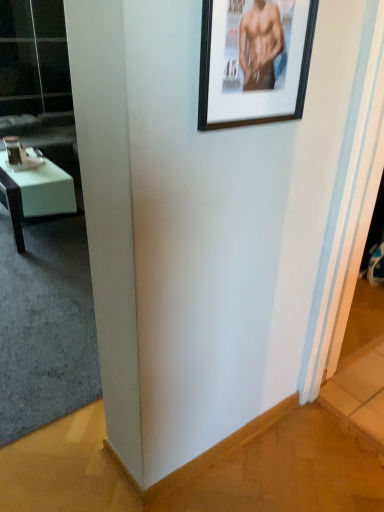
Where is `transparent glass door at upper left`? Image resolution: width=384 pixels, height=512 pixels. transparent glass door at upper left is located at coordinates (33, 58).

I want to click on white leather couch at left, so click(x=39, y=129).

What are the coordinates of `black matte picture frame at upper right` in the screenshot? It's located at (254, 61).

At what (x,y) coordinates should I click in order to perform the action: click on white glossy desk at left. Please return your answer as a coordinate pair (x, y). The image size is (384, 512). Looking at the image, I should click on (35, 194).

Where is `transparent glass door at upper left`? This screenshot has width=384, height=512. transparent glass door at upper left is located at coordinates (33, 58).

Which of these two, black matte picture frame at upper right or white leather couch at left, stands shorter?

With less height is black matte picture frame at upper right.

Is point (245, 96) less distant than point (2, 132)?

Yes, it is.

Which of these two, black matte picture frame at upper right or white leather couch at left, is bigger?

white leather couch at left is bigger.

From the image's perspective, is white leather couch at left on top of black matte picture frame at upper right?

Indeed, from the image's perspective, white leather couch at left is shown above black matte picture frame at upper right.

How many degrees apart are the facing directions of white leather couch at left and black matte picture frame at upper right?

1.63 degrees separate the facing orientations of white leather couch at left and black matte picture frame at upper right.

Can you confirm if white leather couch at left is positioned to the left of black matte picture frame at upper right?

Yes, white leather couch at left is to the left of black matte picture frame at upper right.

What's the angular difference between transparent glass door at upper left and white glossy desk at left's facing directions?

92.6 degrees separate the facing orientations of transparent glass door at upper left and white glossy desk at left.

Does point (58, 57) appear closer or farther from the camera than point (41, 176)?

Point (58, 57).

From a real-world perspective, between transparent glass door at upper left and white glossy desk at left, who is vertically higher?

transparent glass door at upper left.

How far apart are transparent glass door at upper left and white glossy desk at left?

They are 1.95 meters apart.

Is white leather couch at left taller or shorter than transparent glass door at upper left?

In the image, white leather couch at left appears to be shorter than transparent glass door at upper left.

Is white leather couch at left closer to the viewer compared to transparent glass door at upper left?

Yes, white leather couch at left is in front of transparent glass door at upper left.

Looking at the image, does white leather couch at left seem bigger or smaller compared to transparent glass door at upper left?

Clearly, white leather couch at left is larger in size than transparent glass door at upper left.

Does white leather couch at left appear on the left side of transparent glass door at upper left?

In fact, white leather couch at left is to the right of transparent glass door at upper left.

From a real-world perspective, which object rests below the other?

white leather couch at left, from a real-world perspective.

Is transparent glass door at upper left positioned with its back to white leather couch at left?

No, transparent glass door at upper left's orientation is not away from white leather couch at left.

From the image's perspective, would you say transparent glass door at upper left is shown under white leather couch at left?

Incorrect, from the image's perspective, transparent glass door at upper left is higher than white leather couch at left.

In the image, there is a transparent glass door at upper left. At what (x,y) coordinates should I click in order to perform the action: click on couch below it (from a real-world perspective). Please return your answer as a coordinate pair (x, y). Looking at the image, I should click on pyautogui.click(x=39, y=129).

Is white leather couch at left completely or partially inside white glossy desk at left?

Actually, white leather couch at left is outside white glossy desk at left.

Does white glossy desk at left have a greater height compared to white leather couch at left?

Incorrect, the height of white glossy desk at left is not larger of that of white leather couch at left.

Would you say white glossy desk at left is a long distance from white leather couch at left?

No, there isn't a large distance between white glossy desk at left and white leather couch at left.

Which of these two, white glossy desk at left or black matte picture frame at upper right, is thinner?

Thinner between the two is black matte picture frame at upper right.

From a real-world perspective, does white glossy desk at left stand above black matte picture frame at upper right?

No, from a real-world perspective, white glossy desk at left is not over black matte picture frame at upper right

How distant is white glossy desk at left from black matte picture frame at upper right?

white glossy desk at left and black matte picture frame at upper right are 2.14 meters apart.

Is white glossy desk at left facing away from black matte picture frame at upper right?

No, white glossy desk at left's orientation is not away from black matte picture frame at upper right.

This screenshot has height=512, width=384. I want to click on picture frame above the white leather couch at left (from a real-world perspective), so point(254,61).

Where is `picture frame that appears in front of the white leather couch at left`? The image size is (384, 512). picture frame that appears in front of the white leather couch at left is located at coordinates (254, 61).

Looking at the image, which one is located further to black matte picture frame at upper right, white glossy desk at left or white leather couch at left?

white leather couch at left is further to black matte picture frame at upper right.

From the image, which object appears to be farther from black matte picture frame at upper right, white leather couch at left or white glossy desk at left?

white leather couch at left is positioned further to the anchor black matte picture frame at upper right.

Estimate the real-world distances between objects in this image. Which object is further from white leather couch at left, white glossy desk at left or black matte picture frame at upper right?

black matte picture frame at upper right is positioned further to the anchor white leather couch at left.

Looking at the image, which one is located further to black matte picture frame at upper right, transparent glass door at upper left or white leather couch at left?

transparent glass door at upper left.

Based on their spatial positions, is black matte picture frame at upper right or white leather couch at left further from transparent glass door at upper left?

Among the two, black matte picture frame at upper right is located further to transparent glass door at upper left.

From the image, which object appears to be farther from white glossy desk at left, white leather couch at left or black matte picture frame at upper right?

The object further to white glossy desk at left is black matte picture frame at upper right.

Estimate the real-world distances between objects in this image. Which object is closer to black matte picture frame at upper right, white leather couch at left or transparent glass door at upper left?

Among the two, white leather couch at left is located nearer to black matte picture frame at upper right.

Based on their spatial positions, is transparent glass door at upper left or white leather couch at left further from white glossy desk at left?

transparent glass door at upper left is further to white glossy desk at left.

At what (x,y) coordinates should I click in order to perform the action: click on desk positioned between black matte picture frame at upper right and white leather couch at left from near to far. Please return your answer as a coordinate pair (x, y). This screenshot has width=384, height=512. Looking at the image, I should click on (35, 194).

The width and height of the screenshot is (384, 512). What are the coordinates of `couch between transparent glass door at upper left and white glossy desk at left in the up-down direction` in the screenshot? It's located at (39, 129).

Where is `desk between black matte picture frame at upper right and transparent glass door at upper left from front to back`? Image resolution: width=384 pixels, height=512 pixels. desk between black matte picture frame at upper right and transparent glass door at upper left from front to back is located at coordinates (35, 194).

Locate an element on the screen. The width and height of the screenshot is (384, 512). couch positioned between black matte picture frame at upper right and transparent glass door at upper left from near to far is located at coordinates (39, 129).